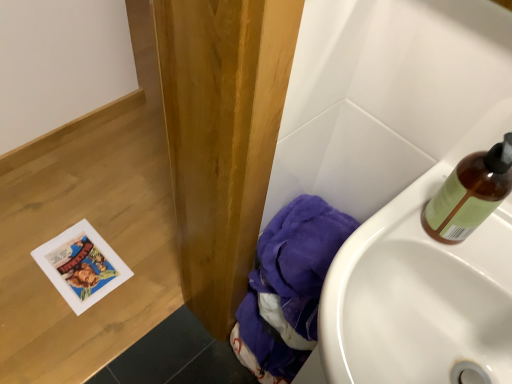
Question: Does purple fabric at lower right have a larger size compared to translucent amber bottle at upper right?

Choices:
 (A) yes
 (B) no

Answer: (A)

Question: Is purple fabric at lower right facing away from translucent amber bottle at upper right?

Choices:
 (A) yes
 (B) no

Answer: (B)

Question: Can you confirm if purple fabric at lower right is thinner than translucent amber bottle at upper right?

Choices:
 (A) no
 (B) yes

Answer: (A)

Question: Can translucent amber bottle at upper right be found inside purple fabric at lower right?

Choices:
 (A) yes
 (B) no

Answer: (B)

Question: Is purple fabric at lower right positioned behind translucent amber bottle at upper right?

Choices:
 (A) yes
 (B) no

Answer: (A)

Question: Is purple fabric at lower right positioned in front of translucent amber bottle at upper right?

Choices:
 (A) yes
 (B) no

Answer: (B)

Question: Considering the relative sizes of translucent amber bottle at upper right and purple fabric at lower right in the image provided, is translucent amber bottle at upper right wider than purple fabric at lower right?

Choices:
 (A) no
 (B) yes

Answer: (A)

Question: Is translucent amber bottle at upper right far from purple fabric at lower right?

Choices:
 (A) yes
 (B) no

Answer: (B)

Question: Is translucent amber bottle at upper right outside of purple fabric at lower right?

Choices:
 (A) yes
 (B) no

Answer: (A)

Question: Is translucent amber bottle at upper right bigger than purple fabric at lower right?

Choices:
 (A) yes
 (B) no

Answer: (B)

Question: Does translucent amber bottle at upper right have a greater height compared to purple fabric at lower right?

Choices:
 (A) no
 (B) yes

Answer: (A)

Question: Can you confirm if translucent amber bottle at upper right is shorter than purple fabric at lower right?

Choices:
 (A) no
 (B) yes

Answer: (B)

Question: Considering the relative sizes of white glossy sink at lower right and purple fabric at lower right in the image provided, is white glossy sink at lower right thinner than purple fabric at lower right?

Choices:
 (A) no
 (B) yes

Answer: (A)